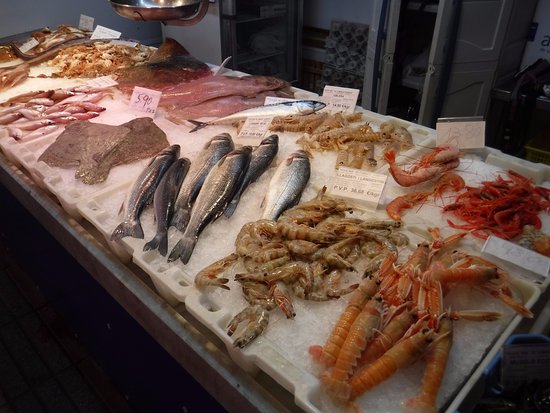
Locate an element on the screen. This screenshot has height=413, width=550. metal pot is located at coordinates (156, 4).